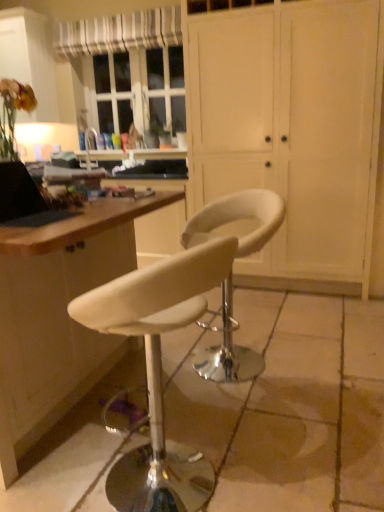
Where is `unoccupied area behind white leather stool at center, which appears as the 2th chair when viewed from the back`? The image size is (384, 512). unoccupied area behind white leather stool at center, which appears as the 2th chair when viewed from the back is located at coordinates (188, 405).